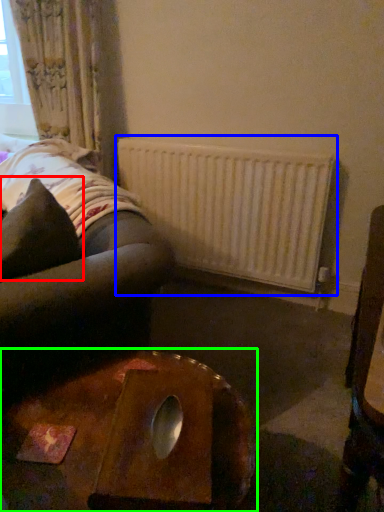
Question: Which is farther away from throw pillow (highlighted by a red box)? radiator (highlighted by a blue box) or table (highlighted by a green box)?

Choices:
 (A) radiator
 (B) table

Answer: (A)